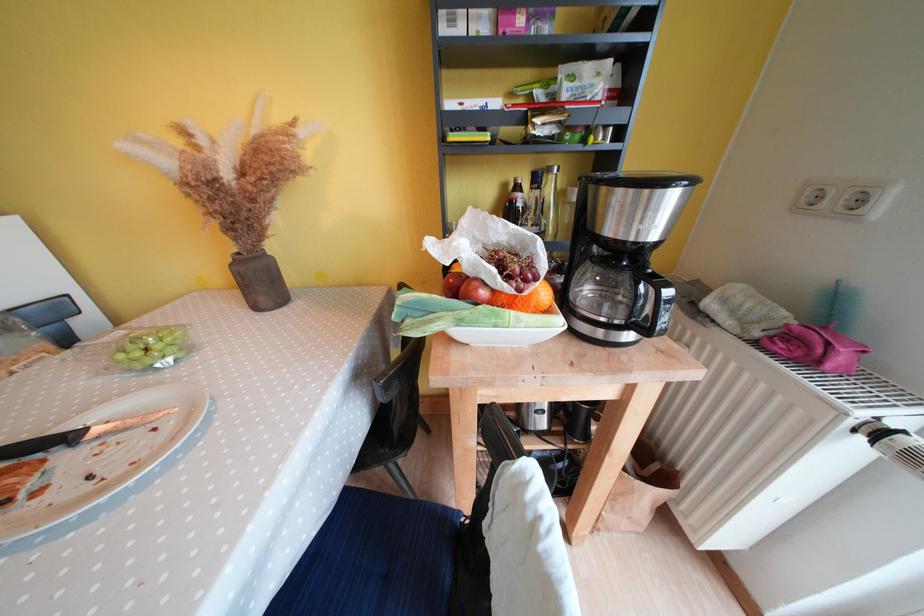
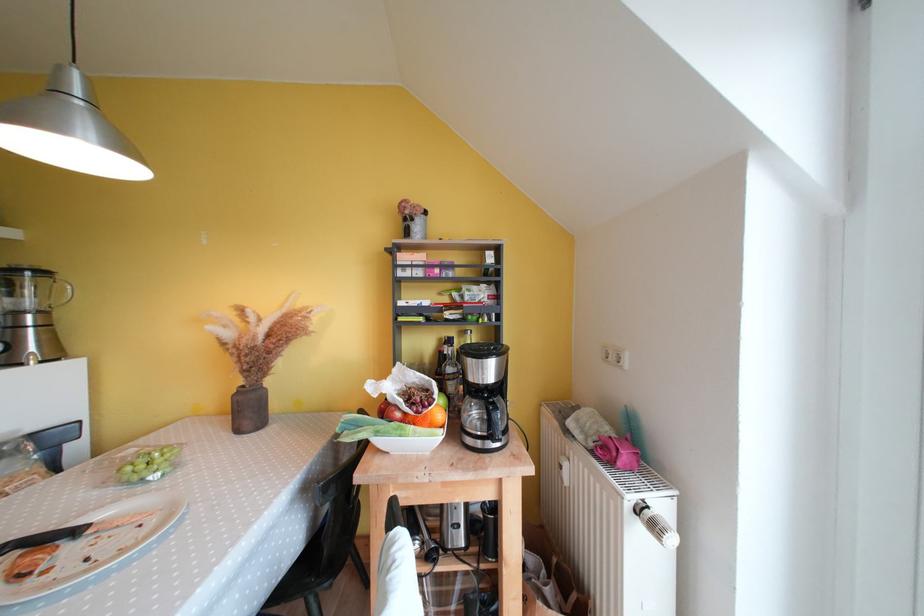
The point at (78, 442) is marked in the first image. Where is the corresponding point in the second image?

(83, 535)